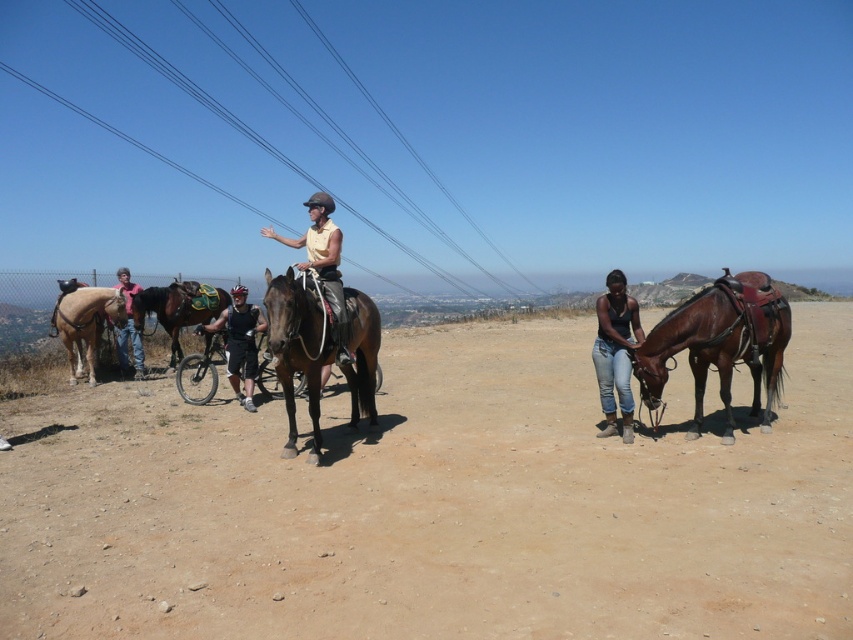
You are a photographer standing at the scene and want to take a photo of the brown leather horse at right. If your camera has a maximum focus range of 5 meters, will you be able to capture the horse clearly?

The brown leather horse at right is 5.76 meters away from the viewer. Since the camera can only focus up to 5 meters, you won that be able to capture the horse clearly within the camera range.

You are a photographer setting up a tripod to capture the scene with the brown leather horse at right and the denim jeans at right. Since you want to ensure both subjects are in focus, which subject should you focus on first to account for their size difference?

The brown leather horse at right is taller than the denim jeans at right, so you should focus on the brown leather horse at right first to ensure both are in focus.

You are a photographer planning to take a photo of the brown leather horse at center and the brushed metal power lines at upper center. To ensure the power lines don not distract from the horse, where should you position the horse in your camera frame?

You should position the brown leather horse at center to the right side of your camera frame so that the brushed metal power lines at upper center, which are on the left side of the horse, will be naturally placed on the left in the photo, minimizing distraction.